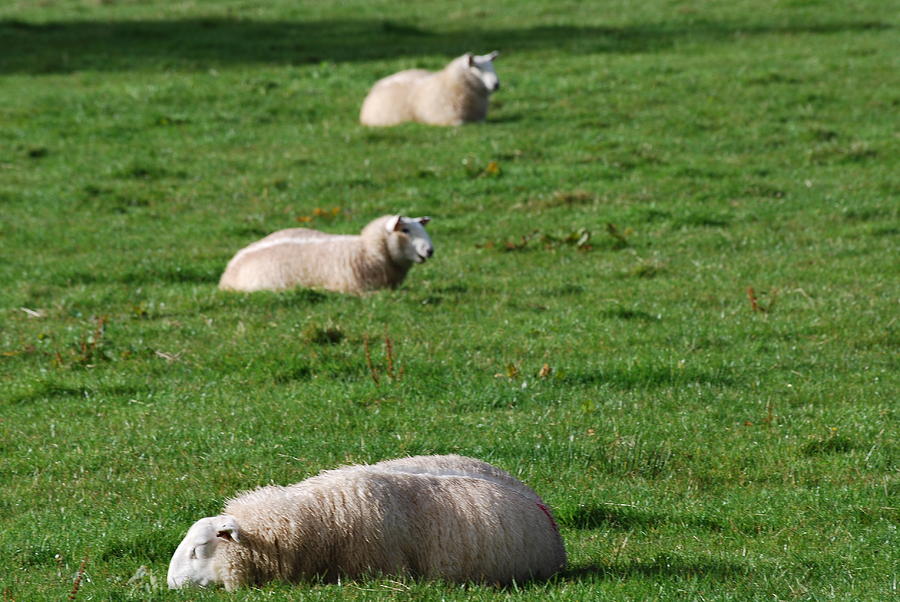
The height and width of the screenshot is (602, 900). What are the coordinates of `shade` in the screenshot? It's located at (109, 33).